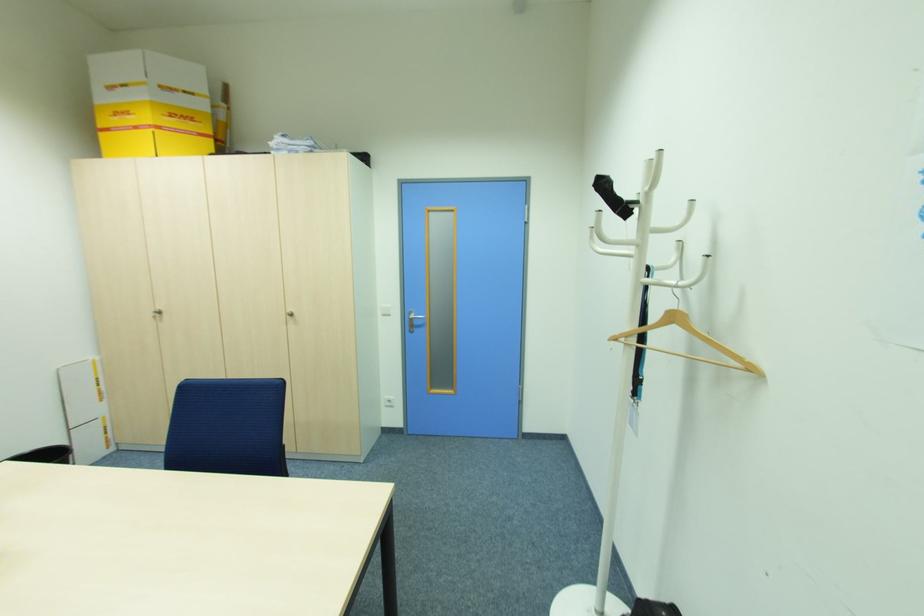
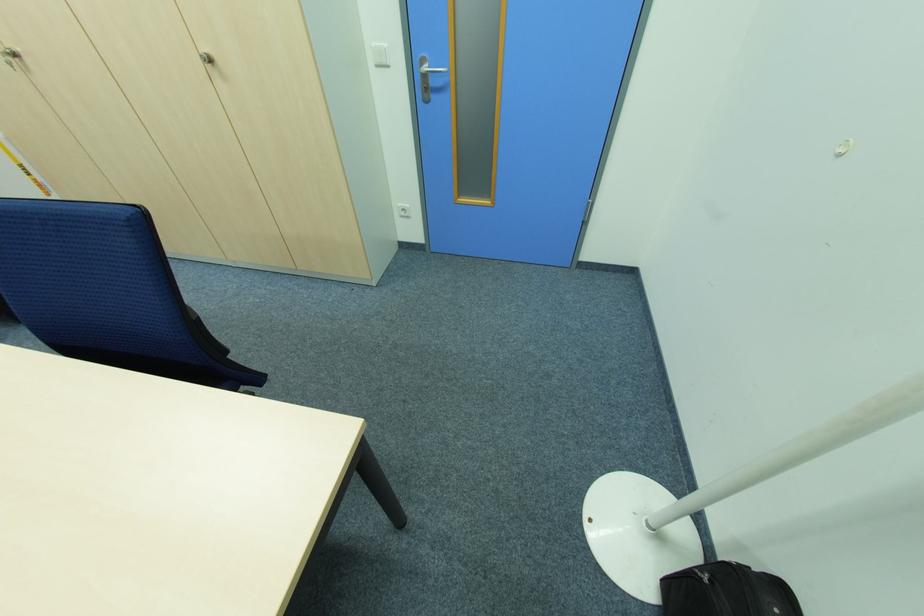
Where in the second image is the point corresponding to pixel 392 400 from the first image?

(407, 209)